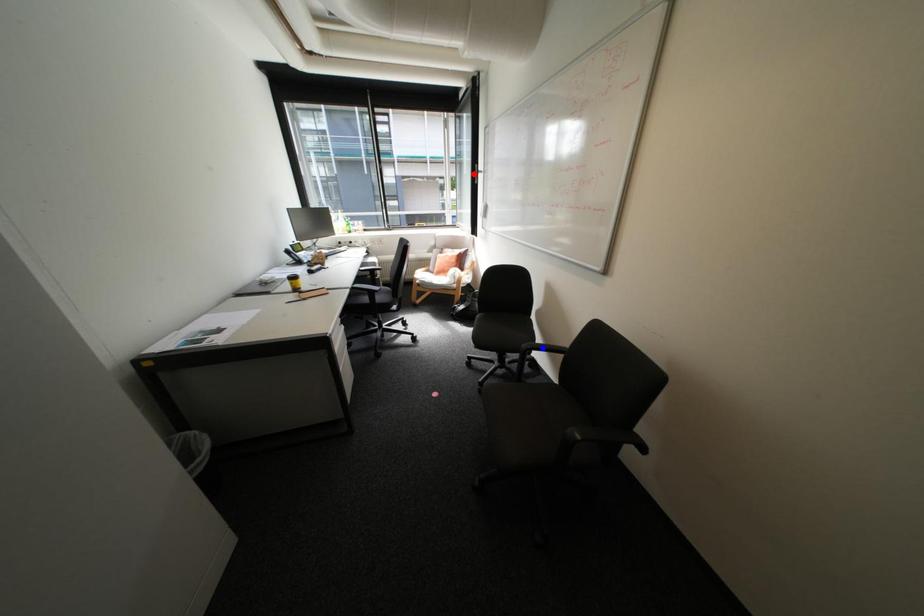
Question: Two points are marked on the image. Which point is closer to the camera?

Choices:
 (A) Blue point is closer.
 (B) Red point is closer.

Answer: (A)